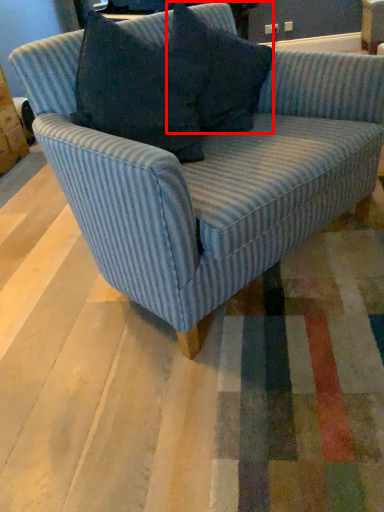
Question: Observing the image, what is the correct spatial positioning of pillow (annotated by the red box) in reference to studio couch?

Choices:
 (A) right
 (B) left

Answer: (A)